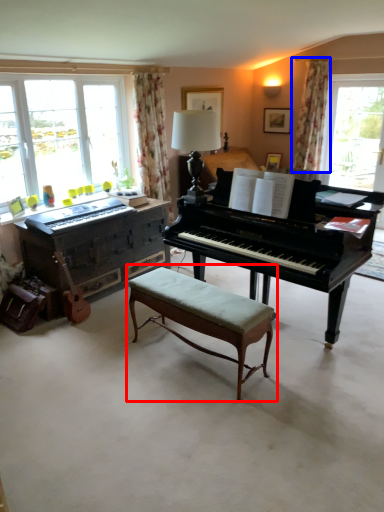
Question: Which object appears farthest to the camera in this image, table (highlighted by a red box) or curtain (highlighted by a blue box)?

Choices:
 (A) table
 (B) curtain

Answer: (B)